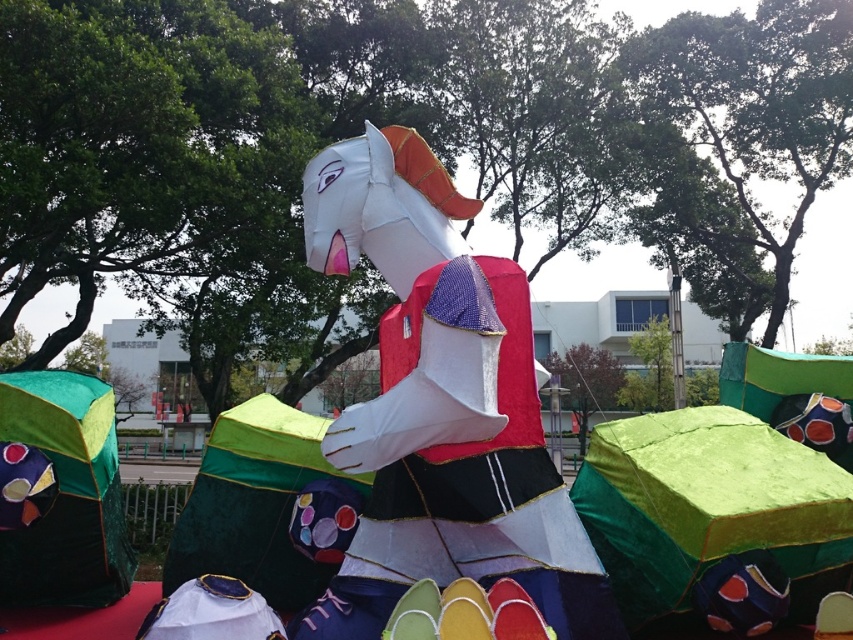
You are an event planner setting up a festival. You have a space that can only accommodate items up to the size of the green fabric umbrella at lower left. Can the matte paper horse at center be placed in this space?

The matte paper horse at center is bigger than the green fabric umbrella at lower left, so it cannot be placed in the space designated for the umbrella.

Looking at this image, you are standing in the outdoor area and want to take a photo of the matte paper horse at center and the green fabric umbrella at lower left. Which object should you place closer to the camera to ensure both are fully visible in the frame?

The matte paper horse at center is positioned on the right side of the green fabric umbrella at lower left. To ensure both are fully visible, you should place the green fabric umbrella at lower left closer to the camera since it is on the left side and might be farther away if the horse is to its right.